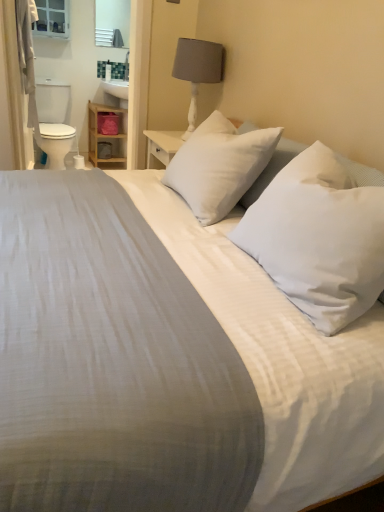
Question: Considering the relative sizes of matte white medicine cabinet at upper left and white glossy toilet bowl at left in the image provided, is matte white medicine cabinet at upper left shorter than white glossy toilet bowl at left?

Choices:
 (A) no
 (B) yes

Answer: (B)

Question: From a real-world perspective, is matte white medicine cabinet at upper left physically below white glossy toilet bowl at left?

Choices:
 (A) no
 (B) yes

Answer: (A)

Question: Can you confirm if matte white medicine cabinet at upper left is smaller than white glossy toilet bowl at left?

Choices:
 (A) no
 (B) yes

Answer: (B)

Question: Can you confirm if matte white medicine cabinet at upper left is wider than white glossy toilet bowl at left?

Choices:
 (A) yes
 (B) no

Answer: (B)

Question: Is white glossy toilet bowl at left inside matte white medicine cabinet at upper left?

Choices:
 (A) yes
 (B) no

Answer: (B)

Question: Is white fabric curtain at left taller or shorter than matte gray fabric lampshade at upper center?

Choices:
 (A) short
 (B) tall

Answer: (B)

Question: From a real-world perspective, relative to matte gray fabric lampshade at upper center, is white fabric curtain at left vertically above or below?

Choices:
 (A) below
 (B) above

Answer: (A)

Question: Does point (18, 88) appear closer or farther from the camera than point (221, 69)?

Choices:
 (A) closer
 (B) farther

Answer: (B)

Question: Looking at the image, does white fabric curtain at left seem bigger or smaller compared to matte gray fabric lampshade at upper center?

Choices:
 (A) small
 (B) big

Answer: (B)

Question: Based on their sizes in the image, would you say matte white medicine cabinet at upper left is bigger or smaller than wooden shelf at left?

Choices:
 (A) small
 (B) big

Answer: (A)

Question: Relative to wooden shelf at left, is matte white medicine cabinet at upper left in front or behind?

Choices:
 (A) behind
 (B) front

Answer: (B)

Question: Does point coord(56,35) appear closer or farther from the camera than point coord(112,151)?

Choices:
 (A) farther
 (B) closer

Answer: (B)

Question: Considering the positions of matte white medicine cabinet at upper left and wooden shelf at left in the image, is matte white medicine cabinet at upper left taller or shorter than wooden shelf at left?

Choices:
 (A) short
 (B) tall

Answer: (A)

Question: Is matte gray fabric lampshade at upper center wider or thinner than white soft pillow at center, the second pillow when ordered from back to front?

Choices:
 (A) thin
 (B) wide

Answer: (A)

Question: From a real-world perspective, is matte gray fabric lampshade at upper center positioned above or below white soft pillow at center, the second pillow when ordered from back to front?

Choices:
 (A) above
 (B) below

Answer: (A)